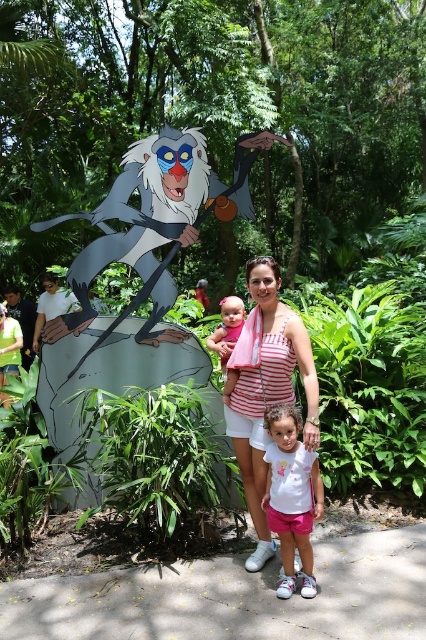
Question: Where is white striped tank top at center located in relation to white matte shirt at center in the image?

Choices:
 (A) above
 (B) below

Answer: (A)

Question: Considering the real-world distances, which object is farthest from the gray plastic figure at left?

Choices:
 (A) white striped tank top at center
 (B) matte pink dress at center

Answer: (A)

Question: Which point appears closest to the camera in this image?

Choices:
 (A) (230, 381)
 (B) (94, 252)
 (C) (227, 310)

Answer: (A)

Question: Is white striped tank top at center to the left of white matte shirt at center from the viewer's perspective?

Choices:
 (A) no
 (B) yes

Answer: (B)

Question: Is white striped tank top at center above matte pink dress at center?

Choices:
 (A) no
 (B) yes

Answer: (A)

Question: Which point is farther to the camera?

Choices:
 (A) white striped tank top at center
 (B) white matte shirt at center
 (C) matte pink dress at center

Answer: (C)